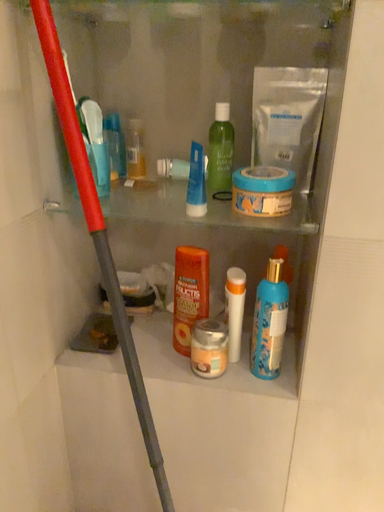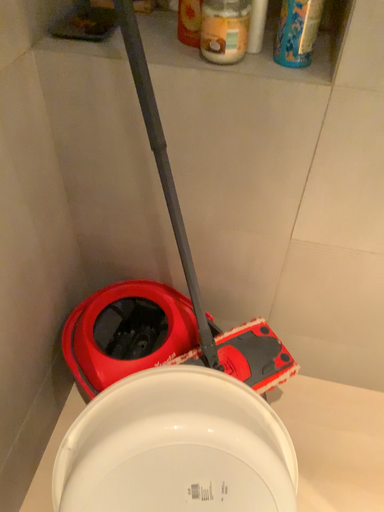
Question: Which way did the camera rotate in the video?

Choices:
 (A) rotated upward
 (B) rotated downward

Answer: (B)